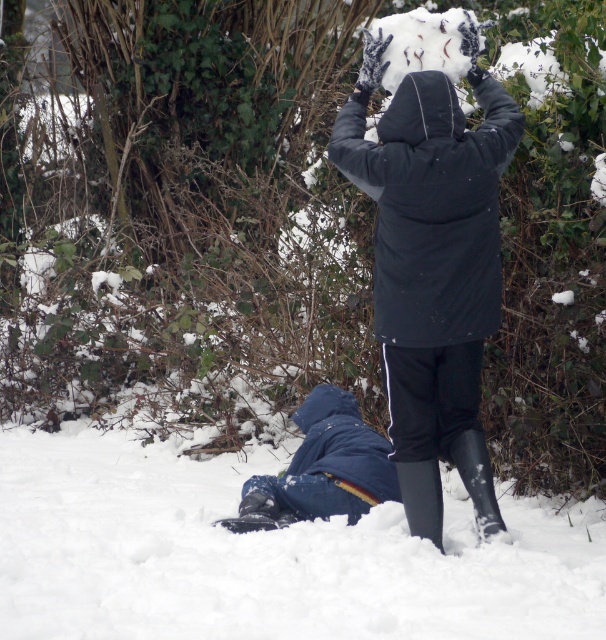
Who is more distant from viewer, (x=484, y=512) or (x=441, y=492)?

The point (x=484, y=512) is behind.

Can you confirm if rubber boots at lower center is positioned below black rubber boot at lower center?

No.

Image resolution: width=606 pixels, height=640 pixels. What do you see at coordinates (478, 480) in the screenshot? I see `rubber boots at lower center` at bounding box center [478, 480].

Locate an element on the screen. rubber boots at lower center is located at coordinates (478, 480).

Who is taller, matte black coat at center or black rubber boot at lower center?

matte black coat at center

Can you confirm if matte black coat at center is smaller than black rubber boot at lower center?

No, matte black coat at center is not smaller than black rubber boot at lower center.

Identify the location of matte black coat at center. (433, 236).

What are the coordinates of `matte black coat at center` in the screenshot? It's located at (433, 236).

Between matte black coat at center and rubber boots at lower center, which one has more height?

Standing taller between the two is matte black coat at center.

Who is shorter, matte black coat at center or rubber boots at lower center?

Standing shorter between the two is rubber boots at lower center.

Does point (493, 512) come closer to viewer compared to point (481, 506)?

Yes, point (493, 512) is closer to viewer.

Identify the location of matte black coat at center. (433, 236).